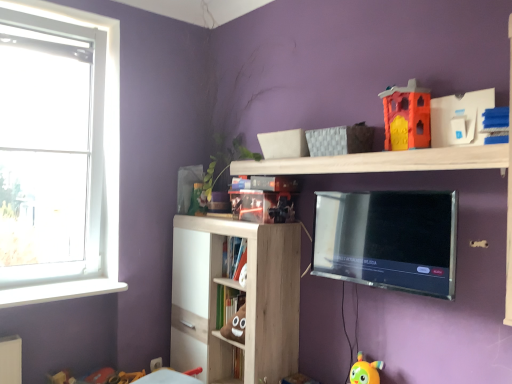
Find the location of a particular element. This screenshot has height=384, width=512. free region under white plastic window at left (from a real-world perspective) is located at coordinates [x=51, y=281].